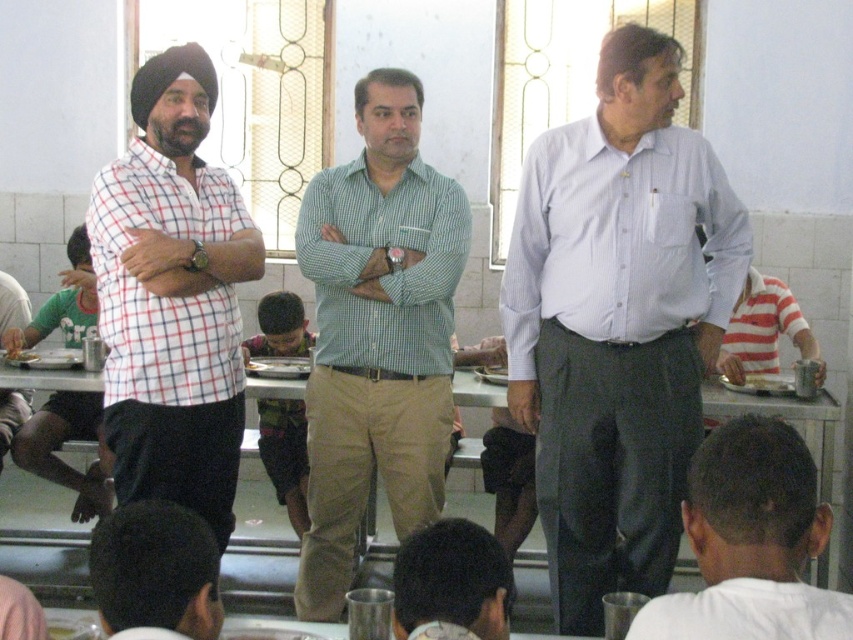
Question: From the image, what is the correct spatial relationship of white matte shirt at center in relation to dark brown leather jacket at lower left?

Choices:
 (A) left
 (B) right

Answer: (B)

Question: Which object is farther from the camera taking this photo?

Choices:
 (A) green checkered shirt at center
 (B) dark brown hair at lower center
 (C) white button-down shirt at center
 (D) matte silver plate at center

Answer: (D)

Question: Can you confirm if checkered fabric shirt at left is positioned below white matte shirt at center?

Choices:
 (A) no
 (B) yes

Answer: (A)

Question: Considering the relative positions of white matte shirt at center and dark brown leather jacket at lower left in the image provided, where is white matte shirt at center located with respect to dark brown leather jacket at lower left?

Choices:
 (A) below
 (B) above

Answer: (B)

Question: Which object is the farthest from the checkered fabric shirt at left?

Choices:
 (A) green checkered shirt at center
 (B) matte plaid shirt at left
 (C) dark brown hair at lower center
 (D) matte silver plate at center

Answer: (B)

Question: Among these points, which one is farthest from the camera?

Choices:
 (A) (96, 528)
 (B) (764, 323)

Answer: (B)